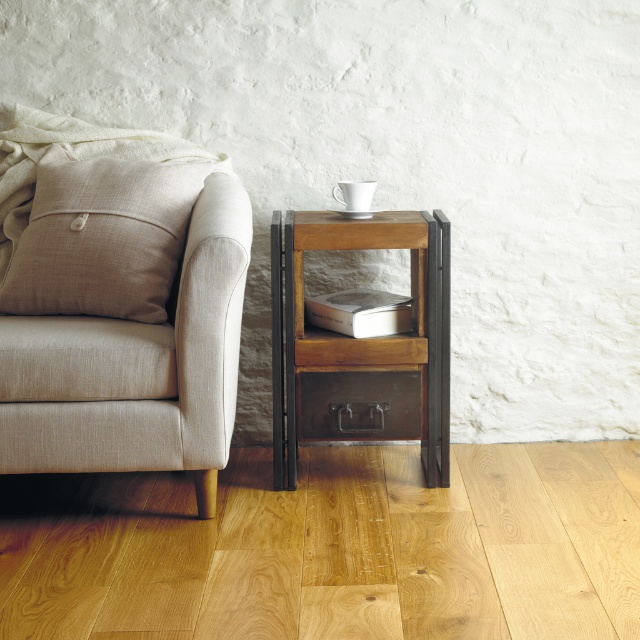
Between woodenmaterial/texturetable at right and beige linen pillow at left, which one appears on the right side from the viewer's perspective?

woodenmaterial/texturetable at right is more to the right.

The width and height of the screenshot is (640, 640). What are the coordinates of `woodenmaterial/texturetable at right` in the screenshot? It's located at (362, 346).

Who is lower down, beige fabric couch at left or beige linen pillow at left?

beige fabric couch at left

Where is `beige fabric couch at left`? beige fabric couch at left is located at coordinates (122, 308).

Between point (177, 413) and point (99, 301), which one is positioned behind?

The point (99, 301) is behind.

Where is `beige fabric couch at left`? This screenshot has width=640, height=640. beige fabric couch at left is located at coordinates (122, 308).

Is beige fabric couch at left further to the viewer compared to woodenmaterial/texturetable at right?

No, it is not.

Is beige fabric couch at left bigger than woodenmaterial/texturetable at right?

Yes, beige fabric couch at left is bigger than woodenmaterial/texturetable at right.

You are a GUI agent. You are given a task and a screenshot of the screen. Output one action in this format:
    pyautogui.click(x=<x>, y=<y>)
    Task: Click on the beige fabric couch at left
    The height and width of the screenshot is (640, 640).
    Given the screenshot: What is the action you would take?
    pyautogui.click(x=122, y=308)